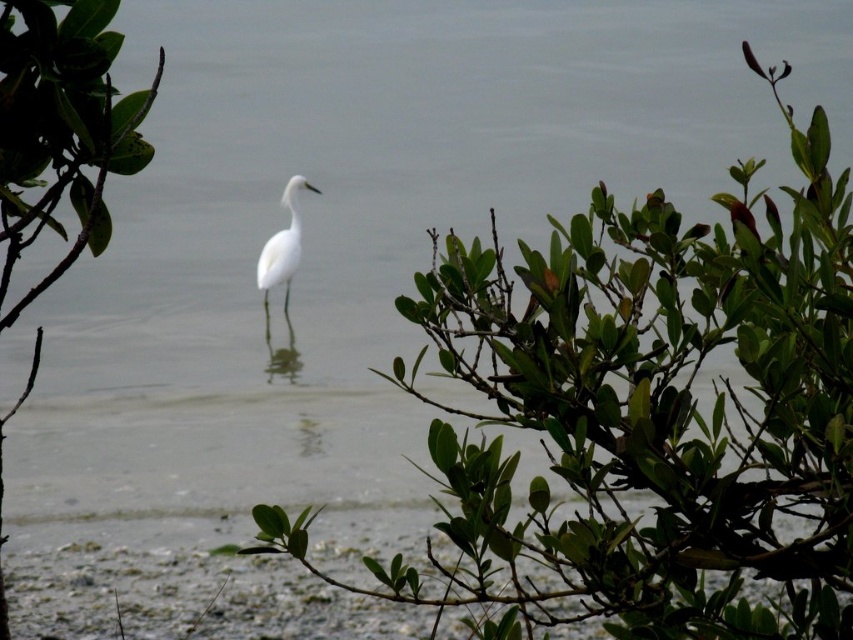
Question: Which point is closer to the camera?

Choices:
 (A) white matte bird at center
 (B) green leafy shrub at center-left
 (C) green leafy shrub at center

Answer: (B)

Question: Considering the real-world distances, which object is farthest from the green leafy shrub at center?

Choices:
 (A) white matte bird at center
 (B) green leafy shrub at center-left

Answer: (A)

Question: Does green leafy shrub at center-left appear on the right side of white matte bird at center?

Choices:
 (A) yes
 (B) no

Answer: (A)

Question: Among these objects, which one is farthest from the camera?

Choices:
 (A) green leafy shrub at center-left
 (B) green leafy shrub at center

Answer: (B)

Question: Is green leafy shrub at center wider than white matte bird at center?

Choices:
 (A) no
 (B) yes

Answer: (B)

Question: Is green leafy shrub at center below green leafy shrub at center-left?

Choices:
 (A) no
 (B) yes

Answer: (B)